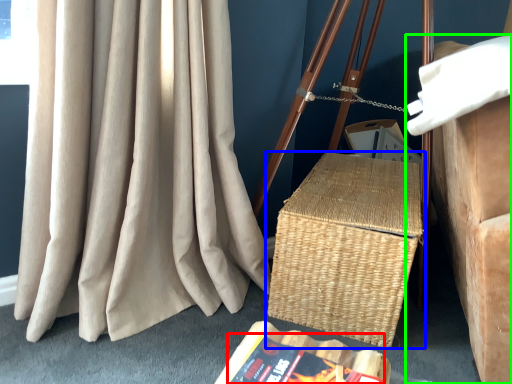
Question: Based on their relative distances, which object is farther from paperback book (highlighted by a red box)? Choose from picnic basket (highlighted by a blue box) and furniture (highlighted by a green box).

Choices:
 (A) picnic basket
 (B) furniture

Answer: (B)